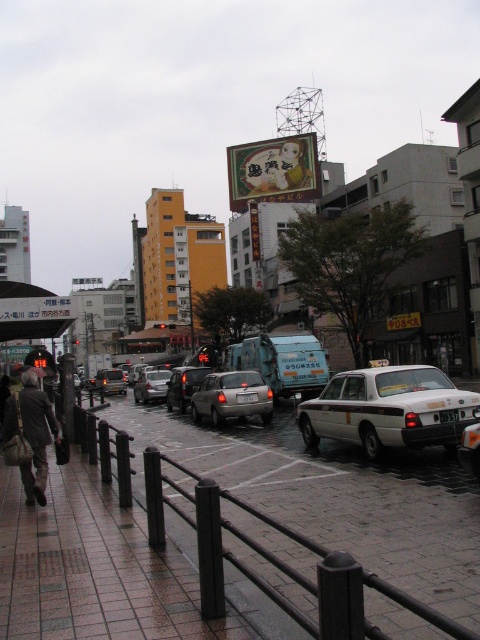
You are a delivery person needing to deliver a package to the brown leather jacket at lower left. The white glossy taxi at center is blocking the path. Can you estimate if the taxi is big enough to completely block the view to the jacket?

The white glossy taxi at center is larger in size than brown leather jacket at lower left, so it can completely block the view to the jacket.

You are a pedestrian standing at point (277, 368) and want to walk to point (181, 396). Given the urban street scene described, which direction should you move relative to the other point?

You should move backward relative to point (181, 396) because point (277, 368) is in front of it.

You are a delivery person needing to carry a large package that is 2 meters wide. You see the white glossy taxi at center and the brown leather jacket at lower left in the scene. Which object can accommodate the package based on their widths?

The white glossy taxi at center has a greater width than the brown leather jacket at lower left, so the package can fit in the white glossy taxi at center.